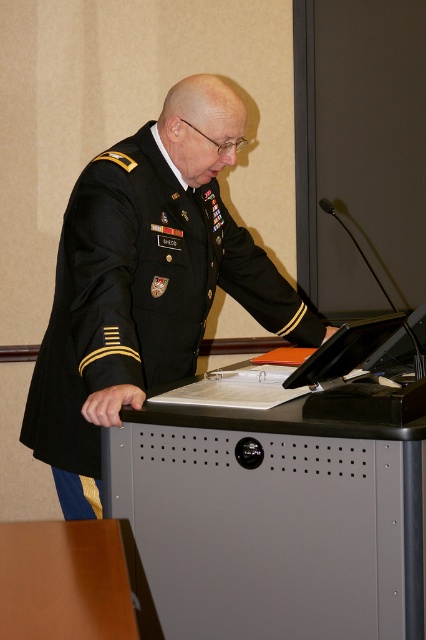
Question: Can you confirm if metallic gray table at center is positioned to the left of black matte military uniform at center?

Choices:
 (A) yes
 (B) no

Answer: (B)

Question: Among these objects, which one is farthest from the camera?

Choices:
 (A) metallic gray table at center
 (B) black matte military uniform at center

Answer: (B)

Question: Does metallic gray table at center have a larger size compared to black matte military uniform at center?

Choices:
 (A) no
 (B) yes

Answer: (A)

Question: Does metallic gray table at center lie in front of black matte military uniform at center?

Choices:
 (A) no
 (B) yes

Answer: (B)

Question: Which of the following is the closest to the observer?

Choices:
 (A) metallic gray table at center
 (B) black matte military uniform at center

Answer: (A)